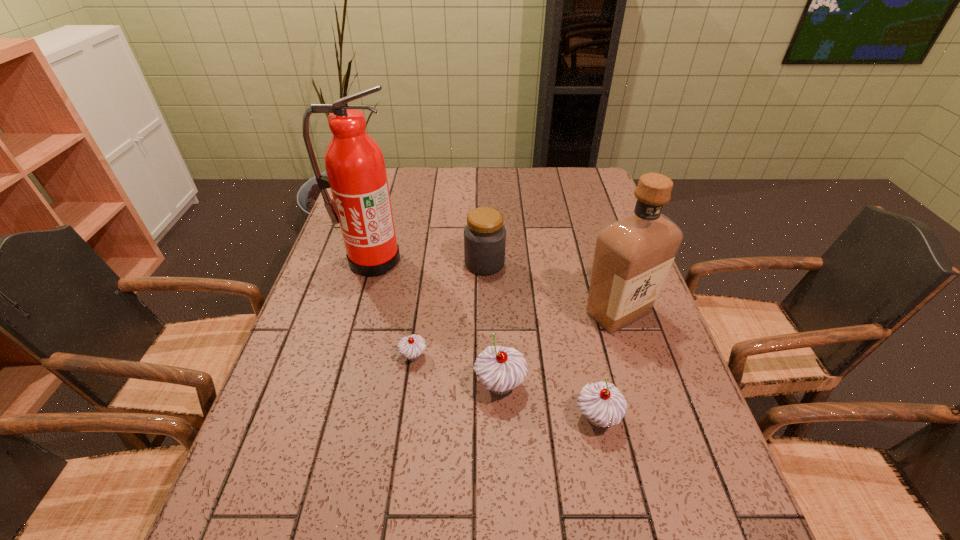
Find the location of a particular element. free space at the far edge of the desktop is located at coordinates (406, 194).

This screenshot has height=540, width=960. Find the location of `vacant position at the near edge of the desktop`. vacant position at the near edge of the desktop is located at coordinates (488, 475).

The image size is (960, 540). Find the location of `vacant space at the left edge of the desktop`. vacant space at the left edge of the desktop is located at coordinates click(325, 257).

In the image, there is a desktop. Where is `vacant region at the right edge`? vacant region at the right edge is located at coordinates (658, 345).

In the image, there is a desktop. Where is `vacant region at the far right corner`? The height and width of the screenshot is (540, 960). vacant region at the far right corner is located at coordinates (589, 192).

In the image, there is a desktop. Identify the location of vacant space at the near right corner. Image resolution: width=960 pixels, height=540 pixels. (712, 455).

At what (x,y) coordinates should I click in order to perform the action: click on vacant region between the fifth object from right to left and the fire extinguisher. Please return your answer as a coordinate pair (x, y). The image size is (960, 540). Looking at the image, I should click on tap(393, 308).

The image size is (960, 540). What are the coordinates of `unoccupied position between the tallest object and the second tallest cupcake` in the screenshot? It's located at (485, 339).

You are a GUI agent. You are given a task and a screenshot of the screen. Output one action in this format:
    pyautogui.click(x=<x>, y=<y>)
    Task: Click on the free point between the second cupcake from right to left and the jar
    The height and width of the screenshot is (540, 960).
    Given the screenshot: What is the action you would take?
    pyautogui.click(x=492, y=324)

Where is `vacant space in between the shortest object and the fire extinguisher`? The image size is (960, 540). vacant space in between the shortest object and the fire extinguisher is located at coordinates (393, 308).